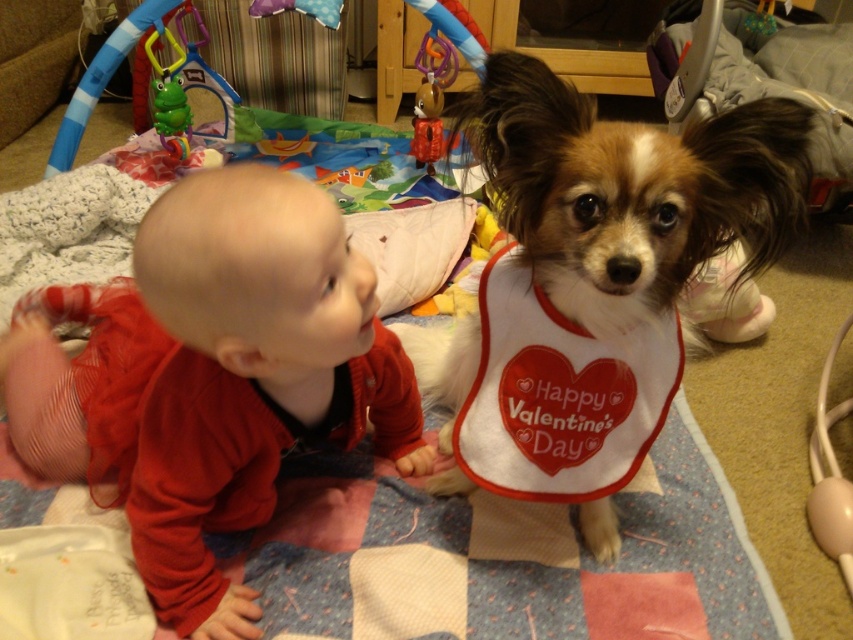
Looking at this image, you are a parent trying to find the green rubber frog at upper left for your baby. Where should you look relative to the white fabric bib at center?

The white fabric bib at center is positioned under the green rubber frog at upper left, so you should look above the white fabric bib at center to find the green rubber frog at upper left.

You are a parent holding a 1.2 meter long blanket. You want to place it between the brown and white fur at center and the green rubber frog at upper left so that both items are covered. Is the blanket long enough to cover both items?

The distance between the brown and white fur at center and the green rubber frog at upper left is 1.19 meters. The blanket is 1.2 meters long, so it is just long enough to cover both items.